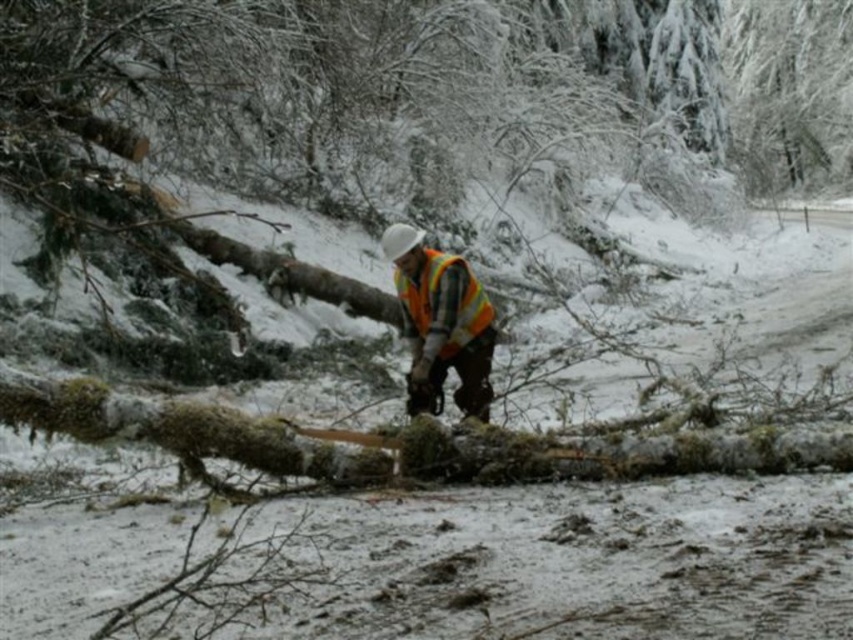
You are a hiker lost in the snowy forest and see the orange reflective vest at center and the reflective orange safety vest at center. Which one is closer to you?

The orange reflective vest at center is closer to the viewer than the reflective orange safety vest at center.

You are a safety inspector reviewing this scene. The safety regulations require that the orange reflective vest must be visible from all angles within a 360 degree radius. Based on the position of the orange reflective vest at center at point (440,323), can you confirm if the vest is positioned correctly to meet this requirement?

The orange reflective vest at center is located at point (440,323), which is the center of the image. Since the vest is centrally positioned, it should be visible from all angles within a 360 degree radius as required by safety regulations.

You are a safety inspector reviewing this scene. You notice two orange safety vests at the center of the image. How far apart are the orange reflective vest at center and the reflective orange safety vest at center?

The orange reflective vest at center is 13.63 centimeters from the reflective orange safety vest at center.